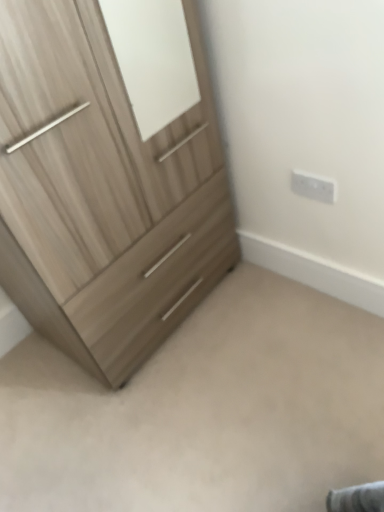
This screenshot has height=512, width=384. In order to click on vacant area that is situated to the right of light wood/texture chest of drawers at left in this screenshot , I will do `click(281, 320)`.